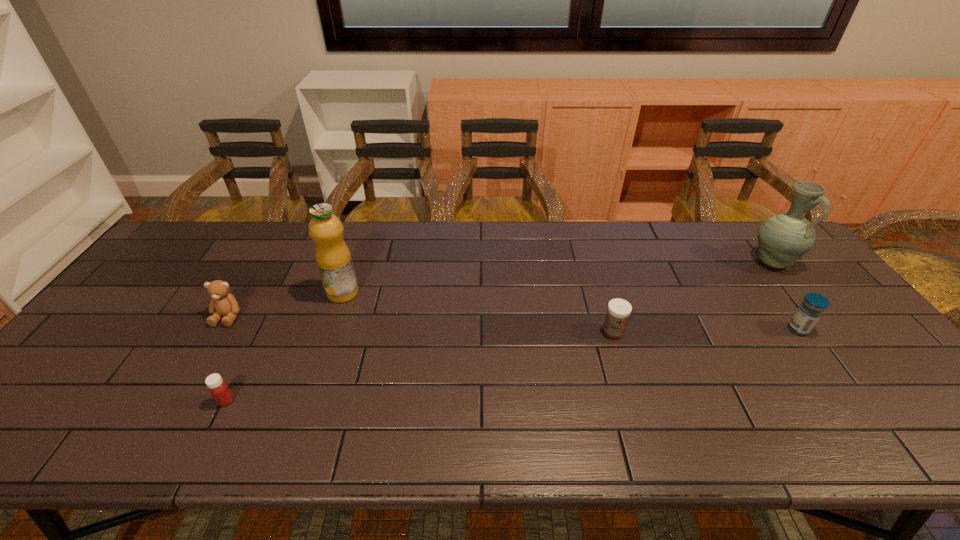
This screenshot has height=540, width=960. What are the coordinates of `free spot located on the front-facing side of the leftmost object` in the screenshot? It's located at (180, 396).

Locate an element on the screen. Image resolution: width=960 pixels, height=540 pixels. free space located on the right of the rightmost medicine is located at coordinates (850, 329).

Where is `free space located on the front of the third object from right to left`? The width and height of the screenshot is (960, 540). free space located on the front of the third object from right to left is located at coordinates (637, 411).

The width and height of the screenshot is (960, 540). I want to click on vacant space situated on the left of the nearest medicine, so click(x=139, y=401).

Where is `object at the far edge`? object at the far edge is located at coordinates (783, 239).

This screenshot has width=960, height=540. In order to click on pitcher present at the right edge in this screenshot , I will do `click(783, 239)`.

Locate an element on the screen. This screenshot has height=540, width=960. medicine that is positioned at the right edge is located at coordinates (811, 309).

Image resolution: width=960 pixels, height=540 pixels. I want to click on object that is positioned at the far right corner, so click(x=783, y=239).

In the image, there is a desktop. At what (x,y) coordinates should I click in order to perform the action: click on blank space at the far edge. Please return your answer as a coordinate pair (x, y). The height and width of the screenshot is (540, 960). Looking at the image, I should click on (493, 262).

In the image, there is a desktop. Where is `free space at the near edge`? The image size is (960, 540). free space at the near edge is located at coordinates (317, 448).